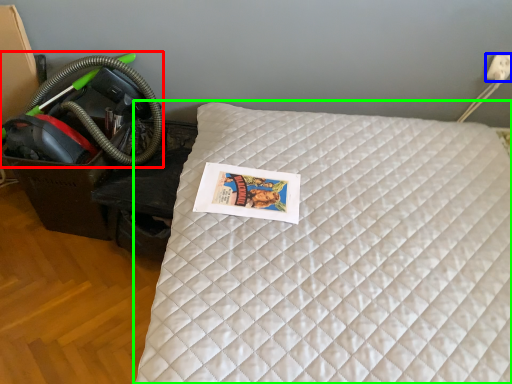
Question: Estimate the real-world distances between objects in this image. Which object is farther from garden hose (highlighted by a red box), electric outlet (highlighted by a blue box) or bed (highlighted by a green box)?

Choices:
 (A) electric outlet
 (B) bed

Answer: (A)